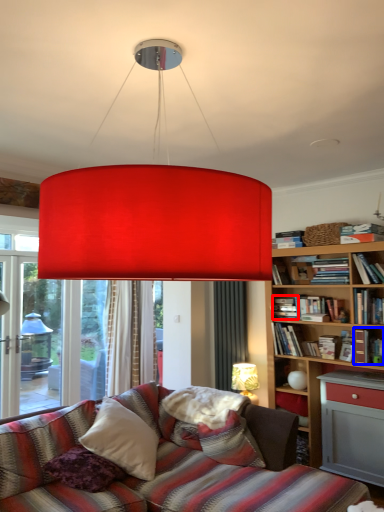
Question: Which object is closer to the camera taking this photo, book (highlighted by a red box) or book (highlighted by a blue box)?

Choices:
 (A) book
 (B) book

Answer: (B)